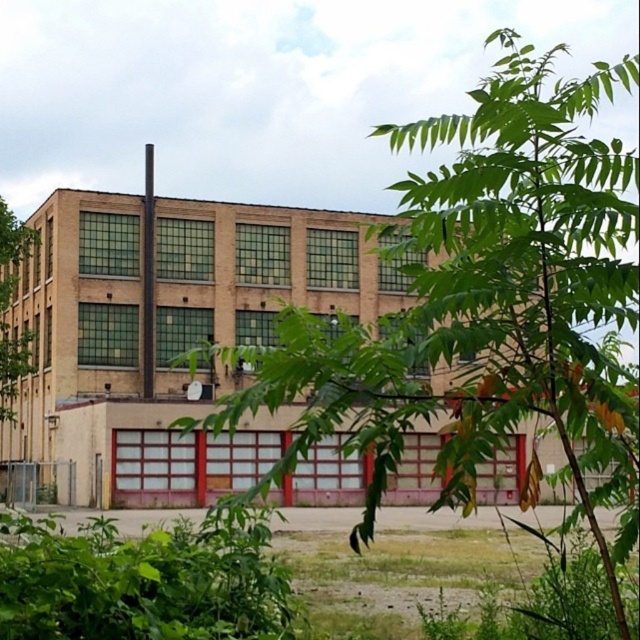
Who is positioned more to the left, brick building at center or green leafy plant at lower left?

brick building at center

Which is more to the right, brick building at center or green leafy plant at lower left?

green leafy plant at lower left

Who is more forward, (x=362, y=467) or (x=152, y=636)?

Positioned in front is point (x=152, y=636).

This screenshot has height=640, width=640. What are the coordinates of `brick building at center` in the screenshot? It's located at (164, 328).

Is the position of green leafy tree at center less distant than that of green leafy plant at lower left?

No, it is not.

Based on the photo, is green leafy tree at center smaller than green leafy plant at lower left?

Actually, green leafy tree at center might be larger than green leafy plant at lower left.

This screenshot has height=640, width=640. What do you see at coordinates (484, 305) in the screenshot?
I see `green leafy tree at center` at bounding box center [484, 305].

Locate an element on the screen. green leafy tree at center is located at coordinates (484, 305).

Can you confirm if green leafy tree at center is smaller than green leafy tree at left?

No, green leafy tree at center is not smaller than green leafy tree at left.

Can you confirm if green leafy tree at center is positioned above green leafy tree at left?

Yes.

Describe the element at coordinates (484, 305) in the screenshot. I see `green leafy tree at center` at that location.

You are a GUI agent. You are given a task and a screenshot of the screen. Output one action in this format:
    pyautogui.click(x=<x>, y=<y>)
    Task: Click on the green leafy tree at center
    This screenshot has height=640, width=640.
    Given the screenshot: What is the action you would take?
    pyautogui.click(x=484, y=305)